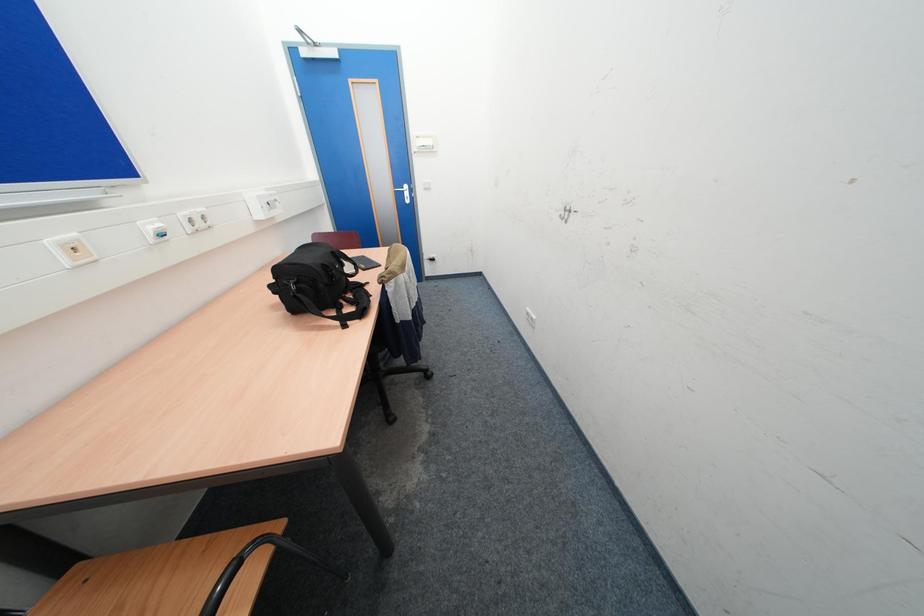
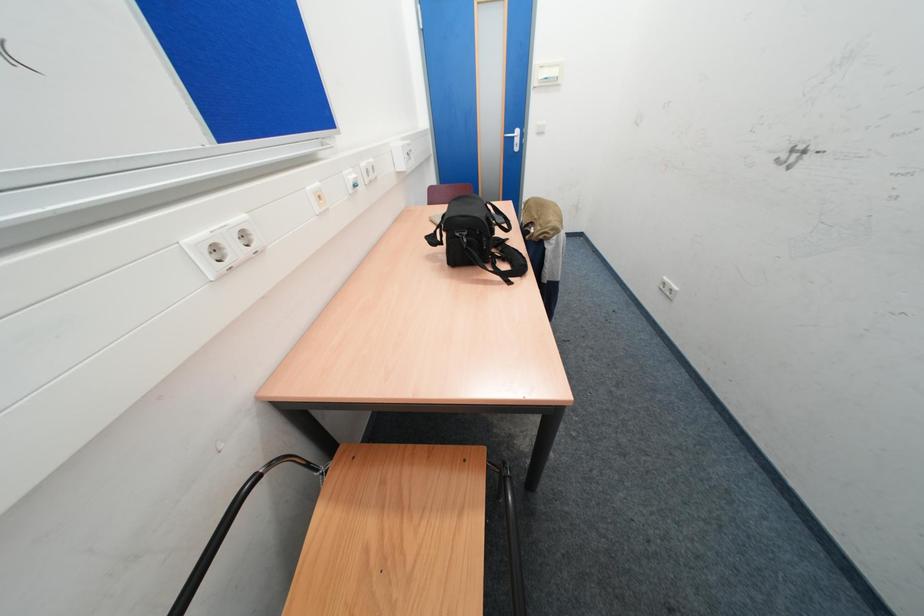
Question: Based on the continuous images, in which direction is the camera rotating? Reply with the corresponding letter.

Choices:
 (A) Left
 (B) Right
 (C) Up
 (D) Down

Answer: (A)